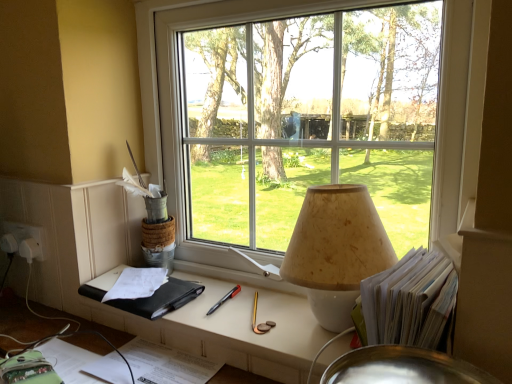
Where is `free location to the right of black leather notebook at lower left`? The width and height of the screenshot is (512, 384). free location to the right of black leather notebook at lower left is located at coordinates (231, 296).